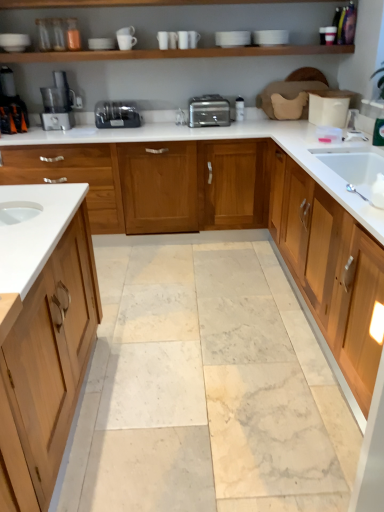
Question: Considering the relative sizes of silver metallic toaster at center and white glossy countertop at center in the image provided, is silver metallic toaster at center bigger than white glossy countertop at center?

Choices:
 (A) no
 (B) yes

Answer: (A)

Question: From the image's perspective, is silver metallic toaster at center located above white glossy countertop at center?

Choices:
 (A) no
 (B) yes

Answer: (B)

Question: From a real-world perspective, is silver metallic toaster at center positioned over white glossy countertop at center based on gravity?

Choices:
 (A) no
 (B) yes

Answer: (B)

Question: Is silver metallic toaster at center at the right side of white glossy countertop at center?

Choices:
 (A) yes
 (B) no

Answer: (A)

Question: Is silver metallic toaster at center behind white glossy countertop at center?

Choices:
 (A) yes
 (B) no

Answer: (A)

Question: From their relative heights in the image, would you say silver metallic toaster at center is taller or shorter than wooden cabinet at right?

Choices:
 (A) tall
 (B) short

Answer: (B)

Question: Visually, is silver metallic toaster at center positioned to the left or to the right of wooden cabinet at right?

Choices:
 (A) right
 (B) left

Answer: (B)

Question: From the image's perspective, is silver metallic toaster at center above or below wooden cabinet at right?

Choices:
 (A) below
 (B) above

Answer: (B)

Question: Is silver metallic toaster at center inside the boundaries of wooden cabinet at right, or outside?

Choices:
 (A) inside
 (B) outside

Answer: (B)

Question: Considering the positions of point (120, 124) and point (177, 120), is point (120, 124) closer or farther from the camera than point (177, 120)?

Choices:
 (A) farther
 (B) closer

Answer: (B)

Question: Visually, is satin silver toaster at center positioned to the left or to the right of silver metallic faucet at center?

Choices:
 (A) left
 (B) right

Answer: (A)

Question: From the image's perspective, relative to silver metallic faucet at center, is satin silver toaster at center above or below?

Choices:
 (A) above
 (B) below

Answer: (B)

Question: Considering the positions of satin silver toaster at center and silver metallic faucet at center in the image, is satin silver toaster at center wider or thinner than silver metallic faucet at center?

Choices:
 (A) thin
 (B) wide

Answer: (B)

Question: Visually, is silver metallic faucet at center positioned to the left or to the right of white glossy countertop at center?

Choices:
 (A) left
 (B) right

Answer: (B)

Question: Is silver metallic faucet at center wider or thinner than white glossy countertop at center?

Choices:
 (A) thin
 (B) wide

Answer: (A)